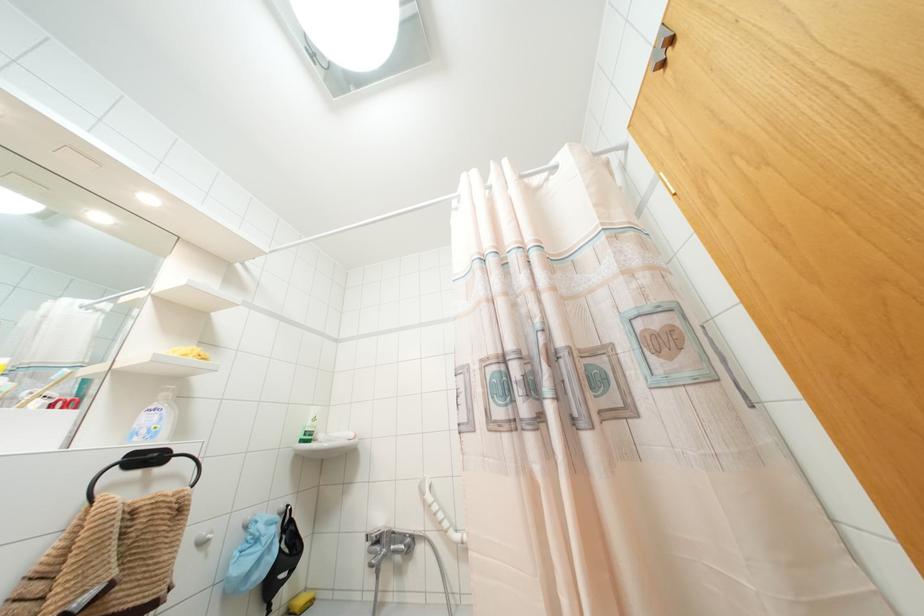
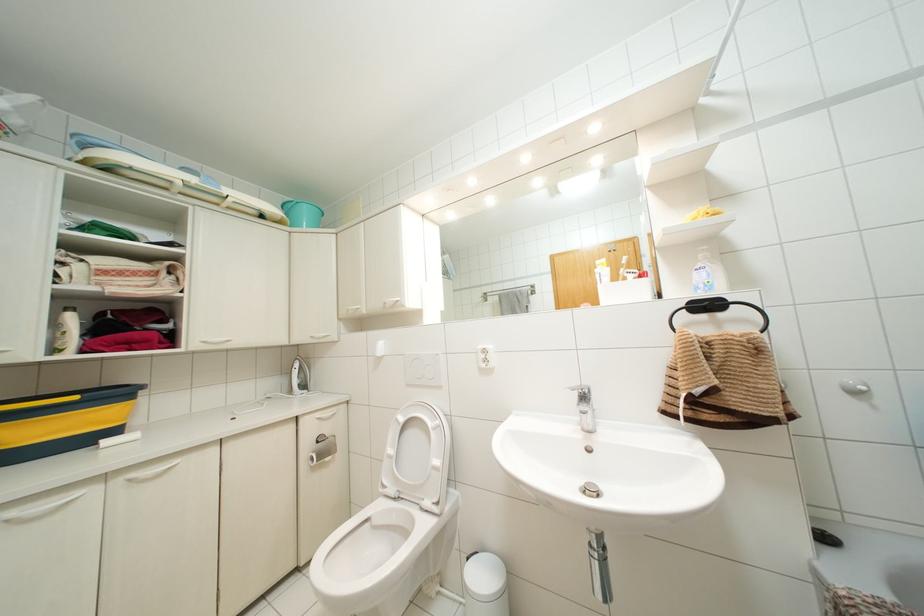
Where in the second image is the point corresponding to point 154,418 from the first image?

(703, 274)